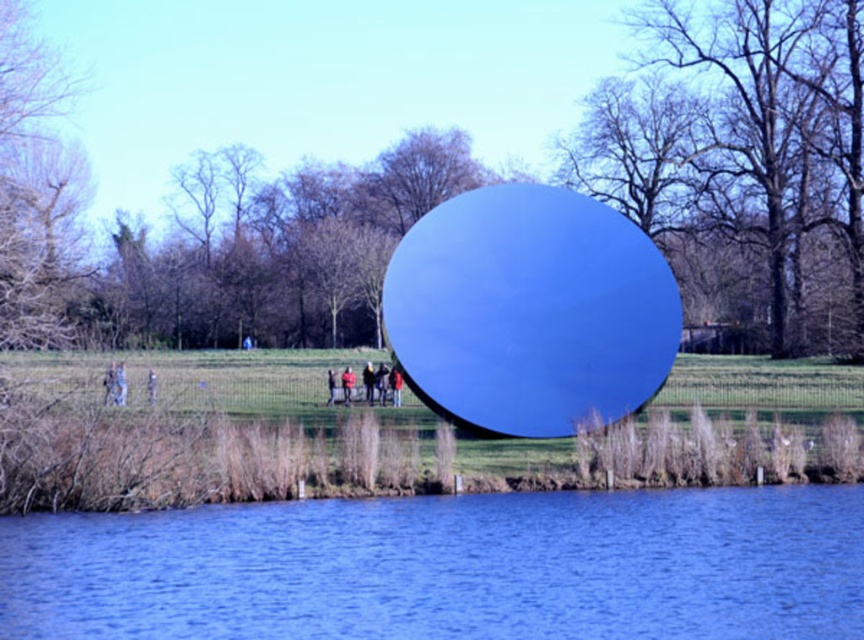
Can you confirm if blue liquid at center is smaller than red jacket at center?

No.

Which is more to the left, blue liquid at center or red jacket at center?

red jacket at center

Which is behind, point (295, 518) or point (342, 372)?

Point (342, 372)

I want to click on blue liquid at center, so click(x=448, y=568).